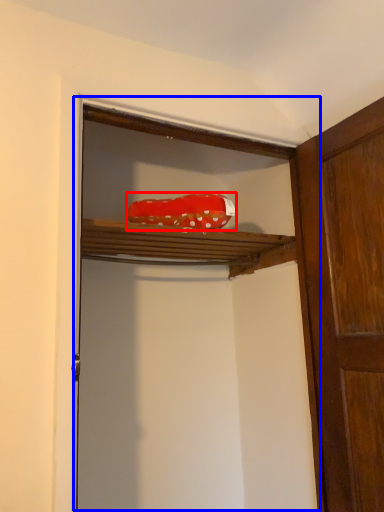
Question: Which object appears farthest to the camera in this image, material (highlighted by a red box) or cabinetry (highlighted by a blue box)?

Choices:
 (A) material
 (B) cabinetry

Answer: (A)